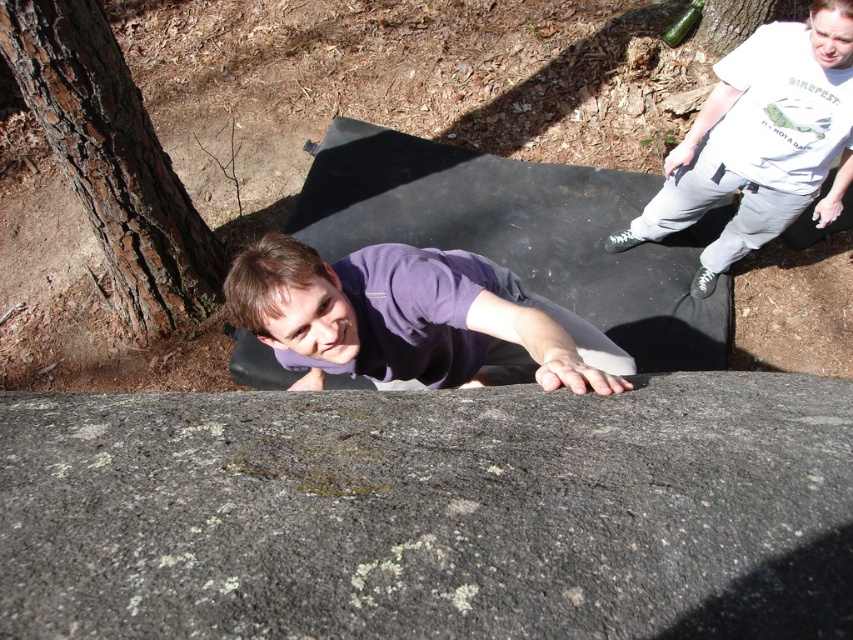
Question: Is gray rough rock at center above brown rough bark at left?

Choices:
 (A) yes
 (B) no

Answer: (B)

Question: Which of these objects is positioned closest to the purple matte shirt at center?

Choices:
 (A) white cotton shirt at upper right
 (B) gray rough rock at center

Answer: (B)

Question: Does gray rough rock at center have a smaller size compared to purple matte shirt at center?

Choices:
 (A) yes
 (B) no

Answer: (A)

Question: Which of the following is the farthest from the observer?

Choices:
 (A) white cotton shirt at upper right
 (B) purple matte shirt at center

Answer: (A)

Question: Is gray rough rock at center to the right of brown rough bark at left from the viewer's perspective?

Choices:
 (A) yes
 (B) no

Answer: (A)

Question: Which object is closer to the camera taking this photo?

Choices:
 (A) purple matte shirt at center
 (B) brown rough bark at left
 (C) white cotton shirt at upper right
 (D) gray rough rock at center

Answer: (D)